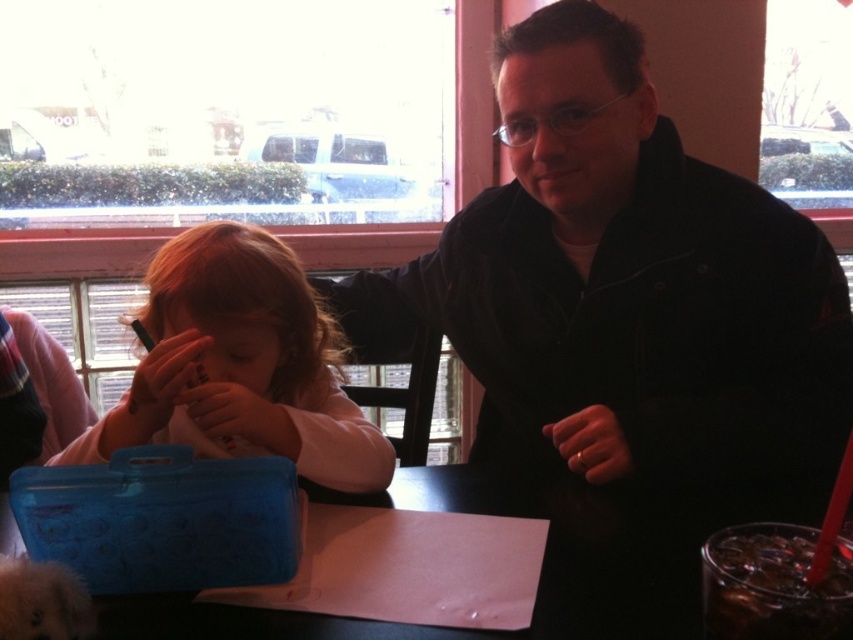
Does black matte jacket at center appear on the left side of black glossy table at center?

Incorrect, black matte jacket at center is not on the left side of black glossy table at center.

The image size is (853, 640). I want to click on black matte jacket at center, so click(625, 296).

Does point (589, 336) come farther from viewer compared to point (643, 586)?

Yes, point (589, 336) is behind point (643, 586).

You are a GUI agent. You are given a task and a screenshot of the screen. Output one action in this format:
    pyautogui.click(x=<x>, y=<y>)
    Task: Click on the black matte jacket at center
    Image resolution: width=853 pixels, height=640 pixels.
    Given the screenshot: What is the action you would take?
    pyautogui.click(x=625, y=296)

Is black glossy table at center positioned behind clear glass drink at lower right?

That is True.

Between point (654, 634) and point (727, 621), which one is positioned in front?

Point (727, 621)

This screenshot has height=640, width=853. Find the location of `black glossy table at center`. black glossy table at center is located at coordinates (541, 564).

This screenshot has height=640, width=853. What do you see at coordinates (625, 296) in the screenshot?
I see `black matte jacket at center` at bounding box center [625, 296].

Where is `black matte jacket at center`? This screenshot has height=640, width=853. black matte jacket at center is located at coordinates (625, 296).